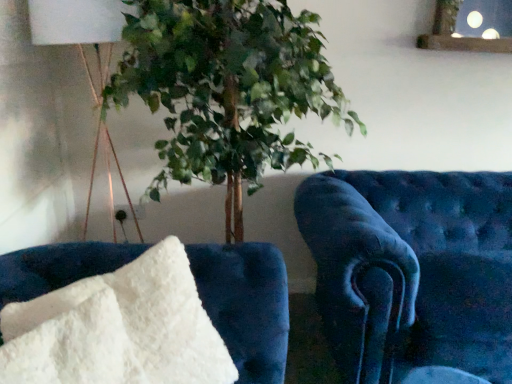
Question: Is the depth of velvet blue armchair at right, the first furniture when ordered from right to left, less than that of white fluffy pillow at lower left, which is the first furniture from left to right?

Choices:
 (A) no
 (B) yes

Answer: (A)

Question: Is velvet blue armchair at right, placed as the 1th furniture when sorted from back to front, shorter than white fluffy pillow at lower left, the second furniture when ordered from back to front?

Choices:
 (A) yes
 (B) no

Answer: (B)

Question: From a real-world perspective, is velvet blue armchair at right, placed as the 1th furniture when sorted from back to front, located beneath white fluffy pillow at lower left, the second furniture when ordered from back to front?

Choices:
 (A) yes
 (B) no

Answer: (A)

Question: Can you confirm if velvet blue armchair at right, the first furniture when ordered from right to left, is positioned to the left of white fluffy pillow at lower left, which is the 2th furniture in right-to-left order?

Choices:
 (A) yes
 (B) no

Answer: (B)

Question: From the image's perspective, does velvet blue armchair at right, positioned as the second furniture in front-to-back order, appear lower than white fluffy pillow at lower left, positioned as the first furniture in front-to-back order?

Choices:
 (A) no
 (B) yes

Answer: (B)

Question: Would you say white fabric lampshade at upper left is inside or outside velvet blue armchair at right, arranged as the second furniture when viewed from the left?

Choices:
 (A) inside
 (B) outside

Answer: (B)

Question: In terms of size, does white fabric lampshade at upper left appear bigger or smaller than velvet blue armchair at right, the first furniture when ordered from right to left?

Choices:
 (A) big
 (B) small

Answer: (B)

Question: Is point (31, 36) closer or farther from the camera than point (357, 329)?

Choices:
 (A) farther
 (B) closer

Answer: (A)

Question: In the image, is white fabric lampshade at upper left positioned in front of or behind velvet blue armchair at right, positioned as the second furniture in front-to-back order?

Choices:
 (A) behind
 (B) front

Answer: (A)

Question: Would you say white fluffy pillow at lower left, the second furniture when ordered from back to front, is to the left or to the right of white fabric lampshade at upper left in the picture?

Choices:
 (A) right
 (B) left

Answer: (A)

Question: Considering their positions, is white fluffy pillow at lower left, which is the 2th furniture in right-to-left order, located in front of or behind white fabric lampshade at upper left?

Choices:
 (A) front
 (B) behind

Answer: (A)

Question: In terms of width, does white fluffy pillow at lower left, which is the first furniture from left to right, look wider or thinner when compared to white fabric lampshade at upper left?

Choices:
 (A) wide
 (B) thin

Answer: (B)

Question: Is white fluffy pillow at lower left, which is the first furniture from left to right, situated inside white fabric lampshade at upper left or outside?

Choices:
 (A) inside
 (B) outside

Answer: (B)

Question: Choose the correct answer: Is velvet blue armchair at right, placed as the 1th furniture when sorted from back to front, inside white fabric lampshade at upper left or outside it?

Choices:
 (A) outside
 (B) inside

Answer: (A)

Question: From a real-world perspective, is velvet blue armchair at right, positioned as the second furniture in front-to-back order, above or below white fabric lampshade at upper left?

Choices:
 (A) below
 (B) above

Answer: (A)